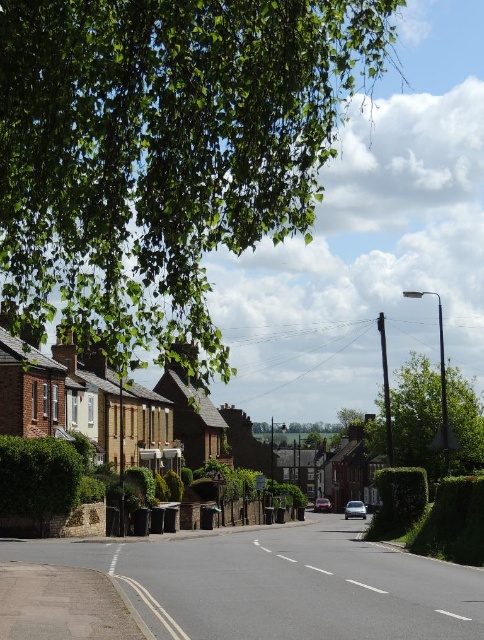
Is green leafy tree at upper left to the left of white plastic street sign at center from the viewer's perspective?

Yes, green leafy tree at upper left is to the left of white plastic street sign at center.

Can you confirm if green leafy tree at upper left is taller than white plastic street sign at center?

Yes, green leafy tree at upper left is taller than white plastic street sign at center.

Is point (178, 81) less distant than point (257, 477)?

Yes, point (178, 81) is closer to viewer.

This screenshot has width=484, height=640. What are the coordinates of `green leafy tree at upper left` in the screenshot? It's located at (164, 152).

Is point (466, 426) more distant than point (316, 499)?

No, (466, 426) is closer to viewer.

Which is in front, point (369, 452) or point (318, 497)?

Point (369, 452) is in front.

Between point (376, 449) and point (319, 509), which one is positioned behind?

Point (319, 509)

Where is `green leafy tree at upper right`? green leafy tree at upper right is located at coordinates (417, 416).

Between green leafy tree at upper left and metallic silver car at center, which one has less height?

metallic silver car at center

Who is lower down, green leafy tree at upper left or metallic silver car at center?

metallic silver car at center is below.

I want to click on green leafy tree at upper left, so click(164, 152).